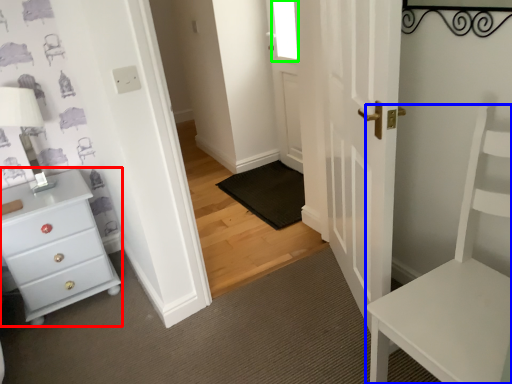
Question: Considering the real-world distances, which object is farthest from chest of drawers (highlighted by a red box)? furniture (highlighted by a blue box) or window (highlighted by a green box)?

Choices:
 (A) furniture
 (B) window

Answer: (B)